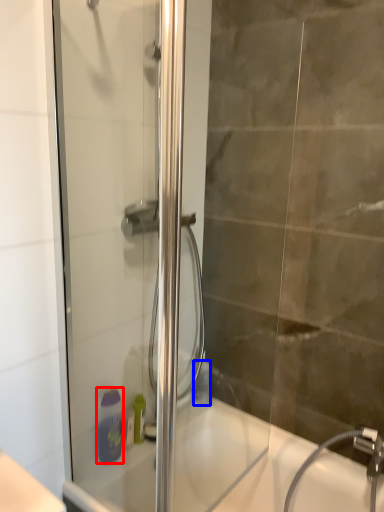
Question: Among these objects, which one is nearest to the camera, soap dispenser (highlighted by a red box) or toiletry (highlighted by a blue box)?

Choices:
 (A) soap dispenser
 (B) toiletry

Answer: (A)